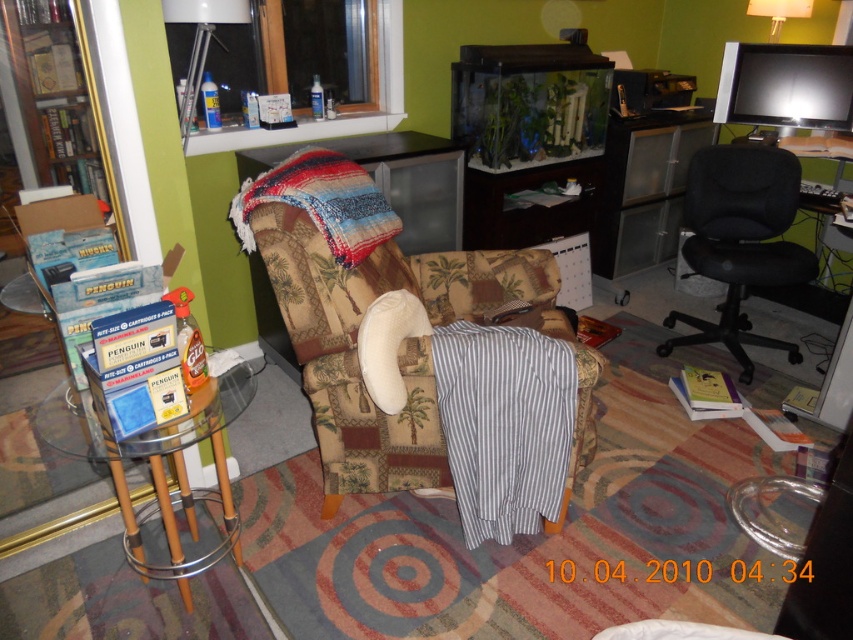
Measure the distance between patterned fabric couch at center and wooden bookshelf at left.

patterned fabric couch at center is 4.90 feet away from wooden bookshelf at left.

Is patterned fabric couch at center to the left of wooden bookshelf at left from the viewer's perspective?

No, patterned fabric couch at center is not to the left of wooden bookshelf at left.

What are the coordinates of `patterned fabric couch at center` in the screenshot? It's located at (399, 346).

The image size is (853, 640). In order to click on patterned fabric couch at center in this screenshot , I will do `click(399, 346)`.

Can you confirm if patterned fabric couch at center is wider than black fabric swivel chair at right?

Correct, the width of patterned fabric couch at center exceeds that of black fabric swivel chair at right.

This screenshot has height=640, width=853. I want to click on patterned fabric couch at center, so click(x=399, y=346).

Is black fabric swivel chair at right closer to the viewer compared to wooden bookshelf at left?

No.

Between point (704, 323) and point (21, 122), which one is positioned in front?

Point (21, 122) is in front.

Locate an element on the screen. The image size is (853, 640). black fabric swivel chair at right is located at coordinates (740, 241).